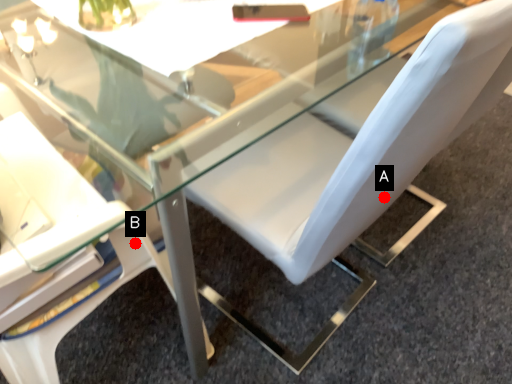
Question: Two points are circled on the image, labeled by A and B beside each circle. Which point appears farthest from the camera in this image?

Choices:
 (A) A is further
 (B) B is further

Answer: (A)